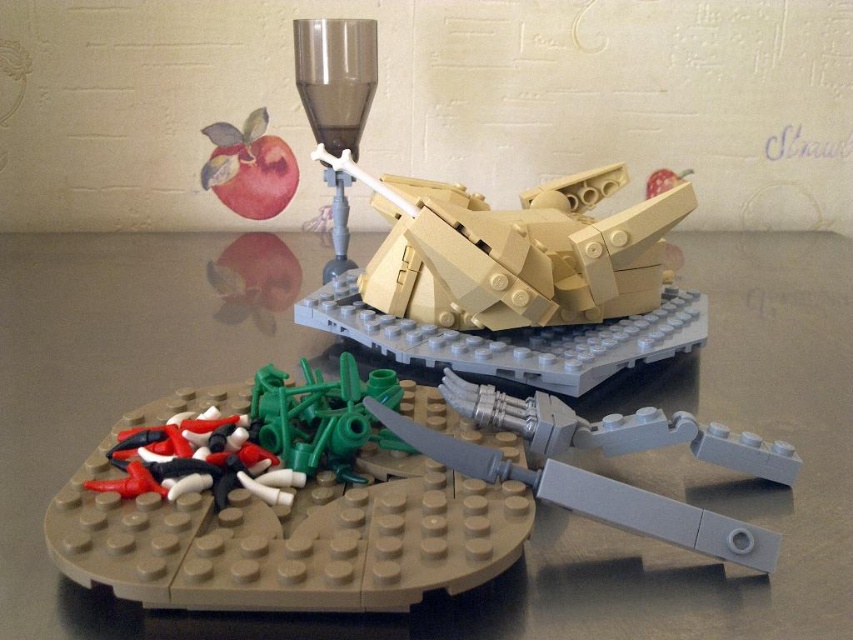
This screenshot has height=640, width=853. Find the location of `gray plastic knife at center`. gray plastic knife at center is located at coordinates (606, 454).

Does gray plastic knife at center appear under matte red apple at upper left?

Correct, gray plastic knife at center is located below matte red apple at upper left.

Describe the element at coordinates (606, 454) in the screenshot. I see `gray plastic knife at center` at that location.

Identify the location of gray plastic knife at center. (606, 454).

Which is more to the right, brown matte table at center or matte red apple at upper left?

Positioned to the right is brown matte table at center.

Measure the distance between brown matte table at center and matte red apple at upper left.

brown matte table at center and matte red apple at upper left are 20.67 inches apart.

Find the location of a particular element. The image size is (853, 640). brown matte table at center is located at coordinates (538, 508).

Is brown matte table at center thinner than tan matte tank at center?

Incorrect, brown matte table at center's width is not less than tan matte tank at center's.

Is point (728, 275) less distant than point (517, 349)?

No.

Between point (294, 240) and point (618, 164), which one is positioned in front?

Point (618, 164) is more forward.

Identify the location of brown matte table at center. (538, 508).